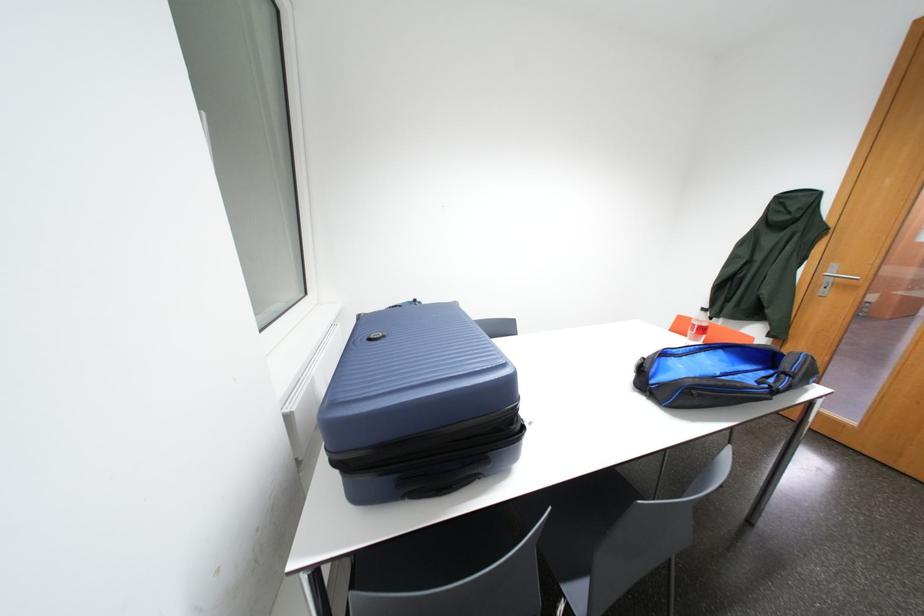
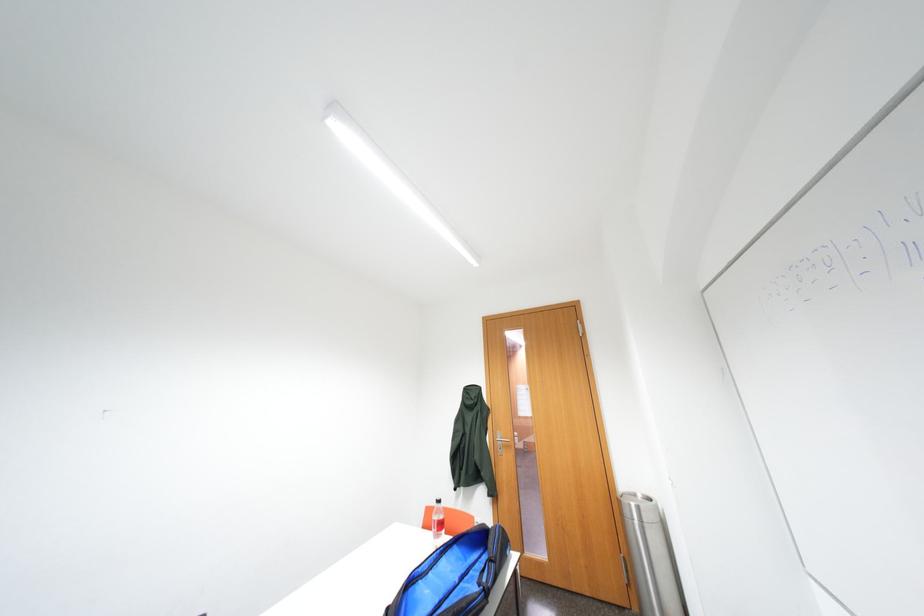
How did the camera likely rotate?

The camera's rotation is toward right-up.